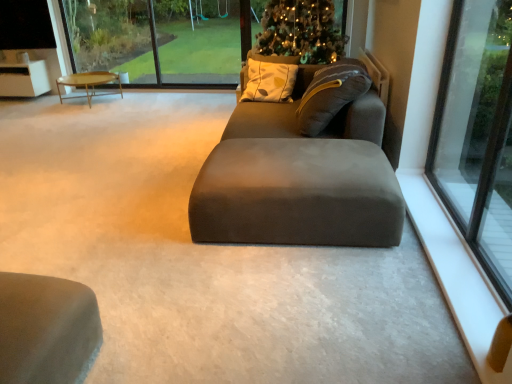
The height and width of the screenshot is (384, 512). I want to click on vacant point above white smooth window sill at lower right (from a real-world perspective), so click(469, 280).